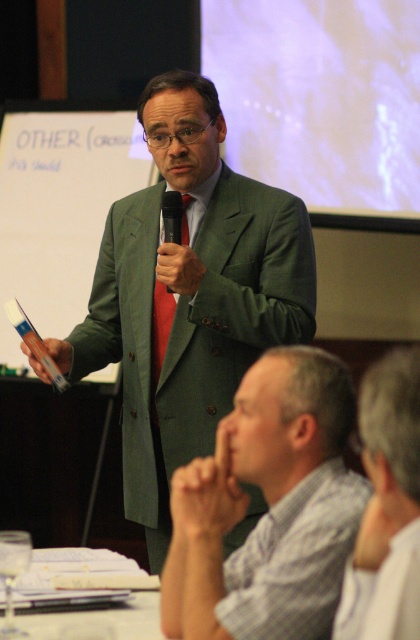
You are an event planner organizing a photoshoot in the presentation room. You need to position a camera to capture both the green wool suit at center and the gray fabric shirt at lower right. Based on their positions, which object should be placed closer to the camera to ensure both are in focus?

The gray fabric shirt at lower right is behind the green wool suit at center, so to ensure both are in focus, the camera should be positioned closer to the green wool suit at center. However, since they are at different depths, achieving focus on both might require adjusting the camera settings for a larger depth of field.